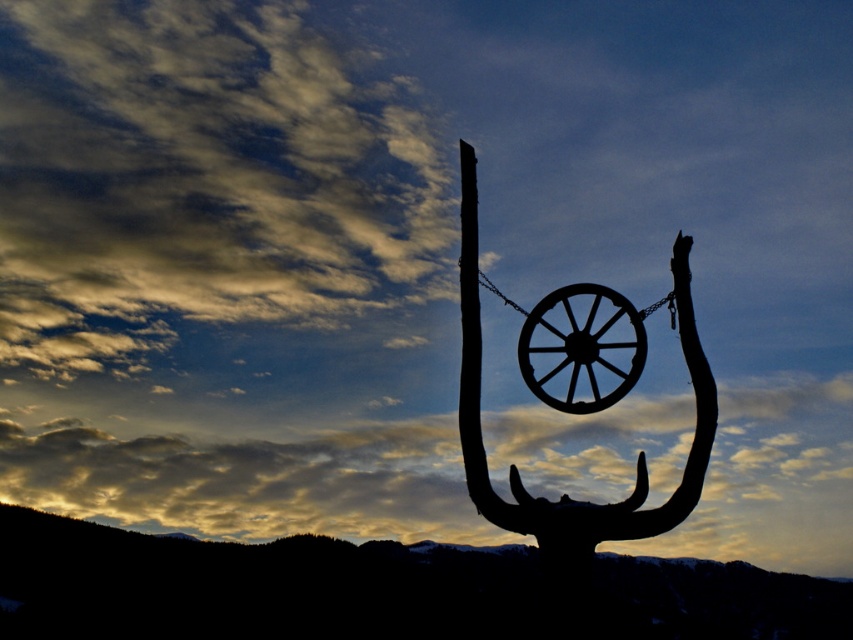
Question: Among these objects, which one is farthest from the camera?

Choices:
 (A) silvery metal wagon wheel at center
 (B) black matte wheel at center

Answer: (B)

Question: Does silvery metal wagon wheel at center appear under black matte wheel at center?

Choices:
 (A) yes
 (B) no

Answer: (B)

Question: In this image, where is silvery metal wagon wheel at center located relative to black matte wheel at center?

Choices:
 (A) above
 (B) below

Answer: (A)

Question: Is silvery metal wagon wheel at center to the left of black matte wheel at center from the viewer's perspective?

Choices:
 (A) no
 (B) yes

Answer: (B)